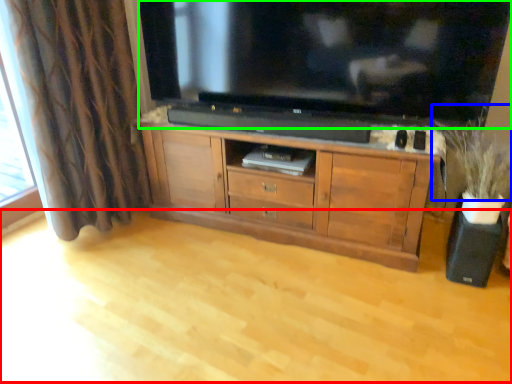
Question: Estimate the real-world distances between objects in this image. Which object is closer to plain (highlighted by a red box), plant (highlighted by a blue box) or television (highlighted by a green box)?

Choices:
 (A) plant
 (B) television

Answer: (A)